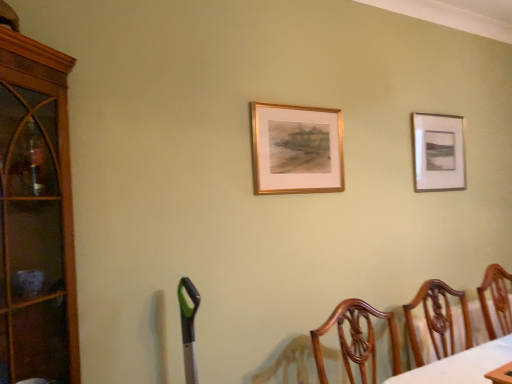
Question: Is brown wood cabinet at left turned away from wooden chair at lower right?

Choices:
 (A) yes
 (B) no

Answer: (B)

Question: From the image's perspective, does brown wood cabinet at left appear lower than wooden chair at lower right?

Choices:
 (A) yes
 (B) no

Answer: (B)

Question: Is brown wood cabinet at left bigger than wooden chair at lower right?

Choices:
 (A) yes
 (B) no

Answer: (A)

Question: Is brown wood cabinet at left behind wooden chair at lower right?

Choices:
 (A) no
 (B) yes

Answer: (A)

Question: Considering the relative positions of brown wood cabinet at left and wooden chair at lower right in the image provided, is brown wood cabinet at left to the left of wooden chair at lower right from the viewer's perspective?

Choices:
 (A) yes
 (B) no

Answer: (A)

Question: Does point (509, 332) appear closer or farther from the camera than point (416, 137)?

Choices:
 (A) farther
 (B) closer

Answer: (B)

Question: Which is correct: wooden chair at lower right is inside matte silver picture frame at upper right, positioned as the second picture frame in left-to-right order, or outside of it?

Choices:
 (A) inside
 (B) outside

Answer: (B)

Question: Considering their positions, is wooden chair at lower right located in front of or behind matte silver picture frame at upper right, arranged as the second picture frame when viewed from the front?

Choices:
 (A) front
 (B) behind

Answer: (A)

Question: Considering the positions of wooden chair at lower right and matte silver picture frame at upper right, positioned as the second picture frame in left-to-right order, in the image, is wooden chair at lower right taller or shorter than matte silver picture frame at upper right, positioned as the second picture frame in left-to-right order,?

Choices:
 (A) tall
 (B) short

Answer: (B)

Question: Considering their positions, is wooden chair at lower right located in front of or behind brown wood cabinet at left?

Choices:
 (A) front
 (B) behind

Answer: (B)

Question: Is wooden chair at lower right inside or outside of brown wood cabinet at left?

Choices:
 (A) inside
 (B) outside

Answer: (B)

Question: Is point (499, 311) closer or farther from the camera than point (8, 200)?

Choices:
 (A) farther
 (B) closer

Answer: (A)

Question: In terms of height, does wooden chair at lower right look taller or shorter compared to brown wood cabinet at left?

Choices:
 (A) tall
 (B) short

Answer: (B)

Question: Considering the relative positions of matte silver picture frame at upper right, the first picture frame when ordered from right to left, and brown wood cabinet at left in the image provided, is matte silver picture frame at upper right, the first picture frame when ordered from right to left, to the left or to the right of brown wood cabinet at left?

Choices:
 (A) left
 (B) right

Answer: (B)

Question: From the image's perspective, relative to brown wood cabinet at left, is matte silver picture frame at upper right, positioned as the second picture frame in left-to-right order, above or below?

Choices:
 (A) above
 (B) below

Answer: (A)